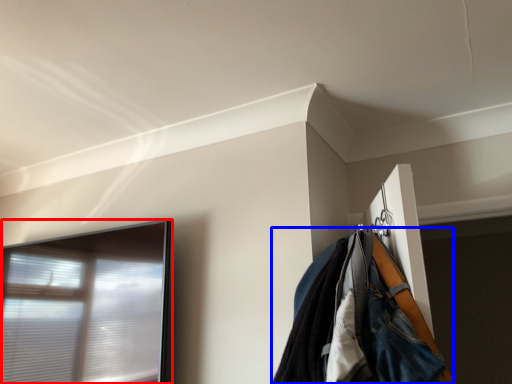
Question: Which object is further to the camera taking this photo, window (highlighted by a red box) or jacket (highlighted by a blue box)?

Choices:
 (A) window
 (B) jacket

Answer: (A)